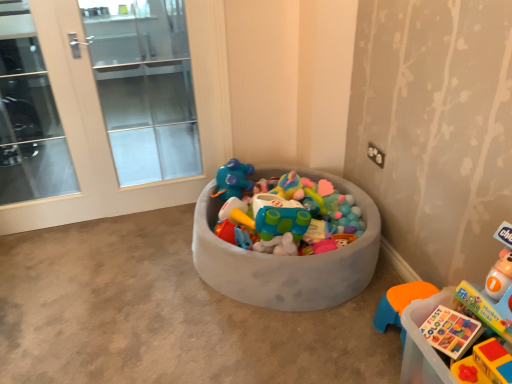
Question: Is white glass screen door at left, which ranks as the 1th screen door in right-to-left order, positioned beyond the bounds of gray fabric toy bin at center?

Choices:
 (A) no
 (B) yes

Answer: (B)

Question: Is white glass screen door at left, positioned as the second screen door in left-to-right order, thinner than gray fabric toy bin at center?

Choices:
 (A) no
 (B) yes

Answer: (B)

Question: Considering the relative sizes of white glass screen door at left, positioned as the second screen door in left-to-right order, and gray fabric toy bin at center in the image provided, is white glass screen door at left, positioned as the second screen door in left-to-right order, smaller than gray fabric toy bin at center?

Choices:
 (A) yes
 (B) no

Answer: (B)

Question: From the image's perspective, would you say white glass screen door at left, which ranks as the 1th screen door in right-to-left order, is shown under gray fabric toy bin at center?

Choices:
 (A) no
 (B) yes

Answer: (A)

Question: Does white glass screen door at left, positioned as the second screen door in left-to-right order, touch gray fabric toy bin at center?

Choices:
 (A) no
 (B) yes

Answer: (A)

Question: Relative to white glass screen door at left, positioned as the second screen door in left-to-right order, is gray fabric toy bin at center in front or behind?

Choices:
 (A) front
 (B) behind

Answer: (A)

Question: In terms of width, does gray fabric toy bin at center look wider or thinner when compared to white glass screen door at left, which ranks as the 1th screen door in right-to-left order?

Choices:
 (A) wide
 (B) thin

Answer: (A)

Question: Is point (325, 352) closer or farther from the camera than point (211, 69)?

Choices:
 (A) closer
 (B) farther

Answer: (A)

Question: From the image's perspective, is gray fabric toy bin at center positioned above or below white glass screen door at left, positioned as the second screen door in left-to-right order?

Choices:
 (A) above
 (B) below

Answer: (B)

Question: Is white glass screen door at left, which ranks as the 1th screen door in right-to-left order, taller or shorter than clear glass door at left, the 2th screen door viewed from the right?

Choices:
 (A) short
 (B) tall

Answer: (B)

Question: Based on their positions, is white glass screen door at left, positioned as the second screen door in left-to-right order, located to the left or right of clear glass door at left, which appears as the 1th screen door when viewed from the left?

Choices:
 (A) left
 (B) right

Answer: (B)

Question: In the image, is white glass screen door at left, which ranks as the 1th screen door in right-to-left order, positioned in front of or behind clear glass door at left, the 2th screen door viewed from the right?

Choices:
 (A) behind
 (B) front

Answer: (B)

Question: From the image's perspective, is white glass screen door at left, positioned as the second screen door in left-to-right order, positioned above or below clear glass door at left, the 2th screen door viewed from the right?

Choices:
 (A) below
 (B) above

Answer: (A)

Question: Choose the correct answer: Is clear glass door at left, which appears as the 1th screen door when viewed from the left, inside white glass screen door at left, positioned as the second screen door in left-to-right order, or outside it?

Choices:
 (A) outside
 (B) inside

Answer: (B)

Question: Is point (0, 185) closer or farther from the camera than point (83, 180)?

Choices:
 (A) closer
 (B) farther

Answer: (B)